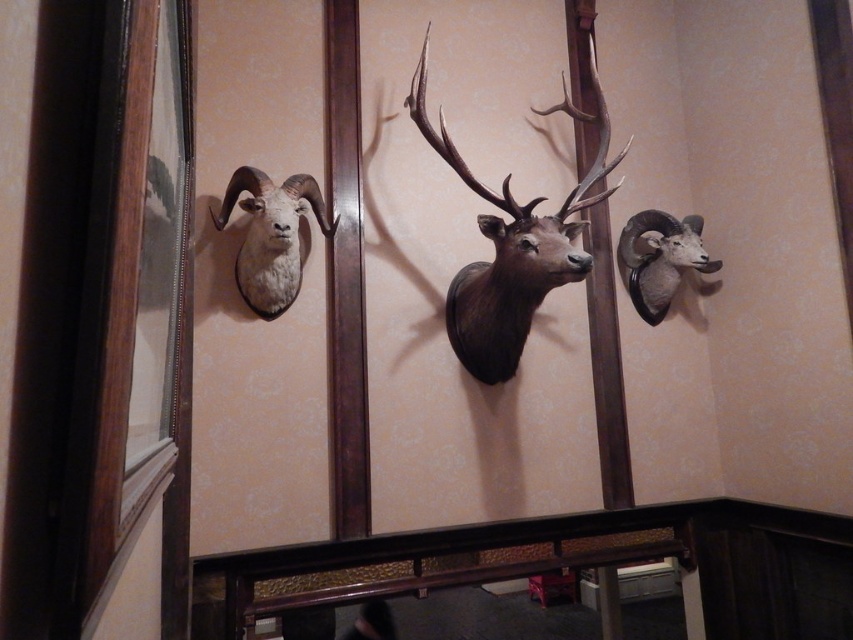
You are an interior designer arranging wall art. You need to ensure that the polished brown moose head at center and the white matte ram head at left are positioned so that the moose head is above the ram head. Does the current arrangement meet this requirement?

Yes, the polished brown moose head at center is located above the white matte ram head at left, so the current arrangement meets the requirement.

You are a professional photographer standing at a certain position. You want to take a closeup photo of the white matte ram head at left. The minimum focusing distance of your camera is 1.8 meters. Can you take the photo without moving closer?

The white matte ram head at left and camera are 2.03 meters apart from each other. Since the minimum focusing distance is 1.8 meters, the camera can focus at 2.03 meters, so yes, you can take the photo without moving closer.